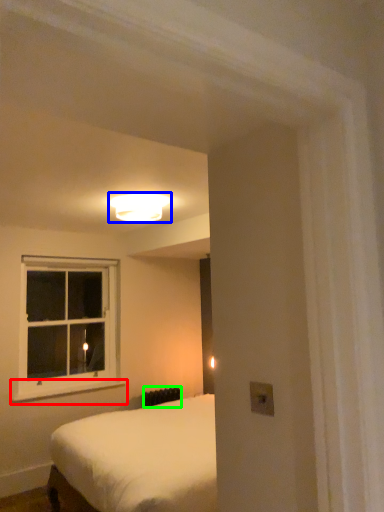
Question: Estimate the real-world distances between objects in this image. Which object is closer to window sill (highlighted by a red box), lamp (highlighted by a blue box) or radiator (highlighted by a green box)?

Choices:
 (A) lamp
 (B) radiator

Answer: (B)